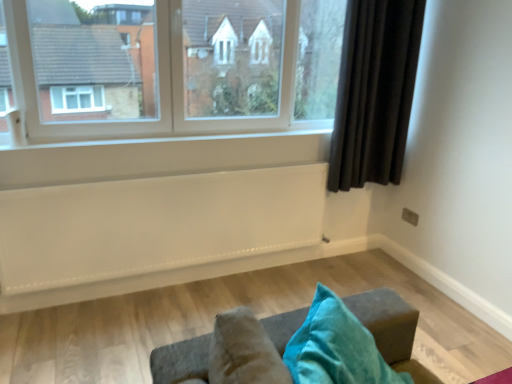
Locate an element on the screen. This screenshot has height=384, width=512. vacant region under clear glass window at upper center (from a real-world perspective) is located at coordinates (181, 130).